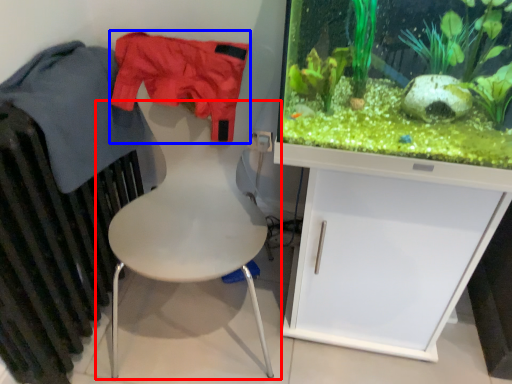
Question: Which object appears closest to the camera in this image, chair (highlighted by a red box) or clothing (highlighted by a blue box)?

Choices:
 (A) chair
 (B) clothing

Answer: (A)